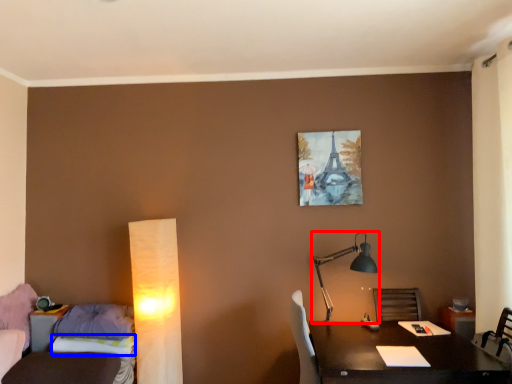
Question: Which object appears farthest to the camera in this image, lamp (highlighted by a red box) or sheet (highlighted by a blue box)?

Choices:
 (A) lamp
 (B) sheet

Answer: (B)